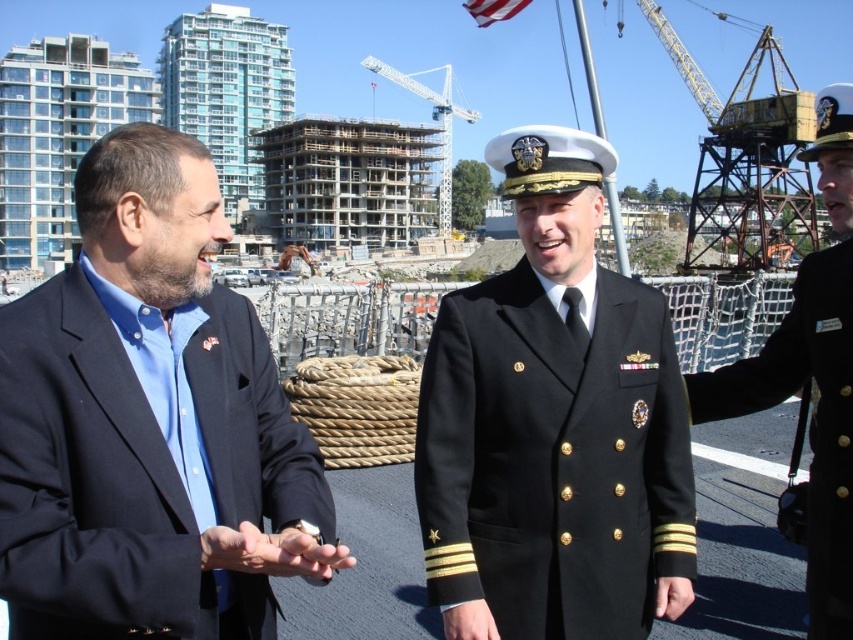
Looking at this image, you are a photographer at the dock, and you need to capture a photo of the black woolen military uniform at center and the black uniform at center. Which one should you focus on first if you want to include both in the frame without cropping?

The black woolen military uniform at center is shorter than the black uniform at center, so you should focus on the black uniform at center first to ensure it fits in the frame without cropping.

You are standing at point (676, 449) and want to walk to the person in the center in the naval uniform. There is an obstacle at point (221, 515). Can you walk around the obstacle to reach your destination?

Point (221, 515) is in front of point (676, 449), so the obstacle is blocking your path. You need to find another route to reach the person in the center in the naval uniform.